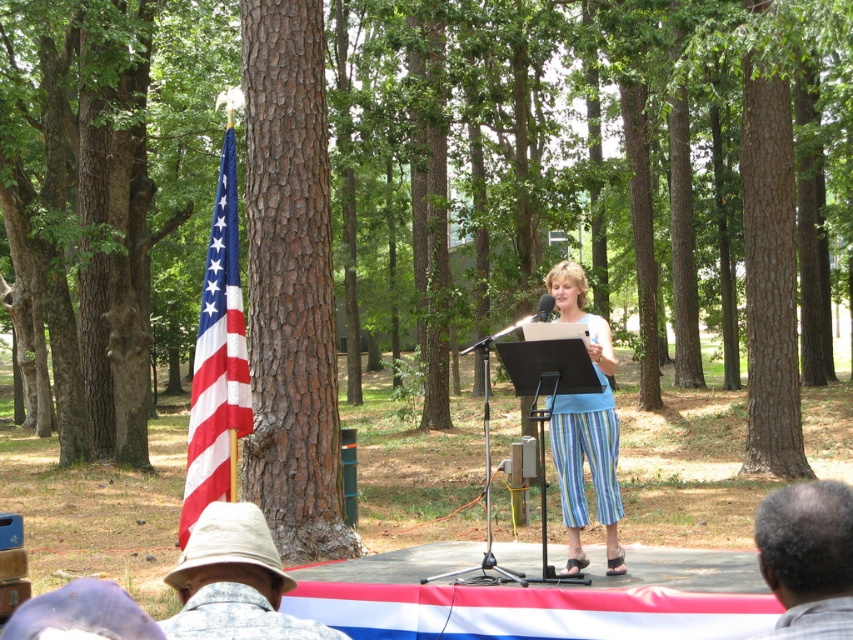
Question: Can you confirm if american flag at left is bigger than tan fabric hat at lower left?

Choices:
 (A) no
 (B) yes

Answer: (B)

Question: Which point is farther to the camera?

Choices:
 (A) blue striped pants at center
 (B) tan fabric hat at lower left
 (C) black plastic microphone at center
 (D) brown rough bark tree at left

Answer: (D)

Question: Is tan fabric hat at lower left to the left of black plastic microphone at center from the viewer's perspective?

Choices:
 (A) yes
 (B) no

Answer: (A)

Question: Which of the following is the closest to the observer?

Choices:
 (A) gray plaid shirt at lower right
 (B) tan fabric hat at lower left
 (C) black plastic microphone at center

Answer: (A)

Question: Based on their relative distances, which object is farther from the brown rough bark tree at left?

Choices:
 (A) gray plaid shirt at lower right
 (B) blue striped pants at center
 (C) american flag at left

Answer: (A)

Question: Is gray plaid shirt at lower right behind blue striped pants at center?

Choices:
 (A) no
 (B) yes

Answer: (A)